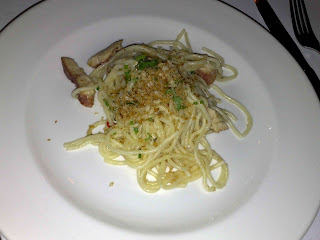
Where is `plate depression/center`? The width and height of the screenshot is (320, 240). plate depression/center is located at coordinates (97, 176).